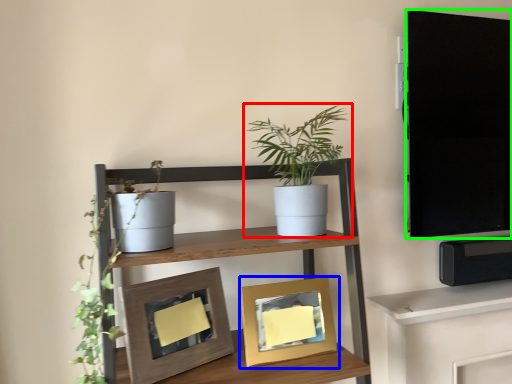
Question: Based on their relative distances, which object is farther from houseplant (highlighted by a red box)? Choose from picture frame (highlighted by a blue box) and tv cabinet (highlighted by a green box).

Choices:
 (A) picture frame
 (B) tv cabinet

Answer: (B)